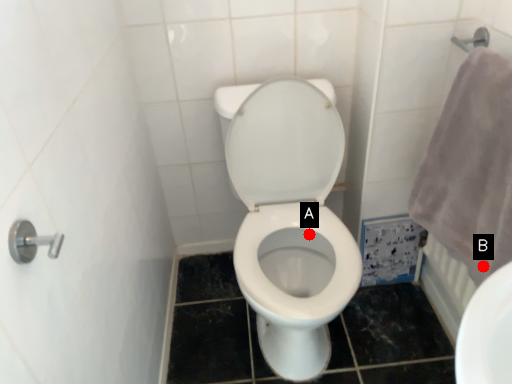
Question: Two points are circled on the image, labeled by A and B beside each circle. Which point is closer to the camera?

Choices:
 (A) A is closer
 (B) B is closer

Answer: (B)